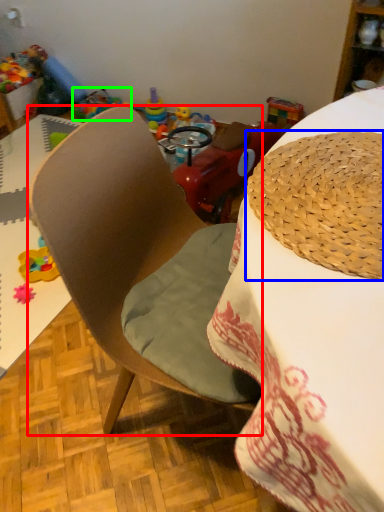
Question: Which object is positioned farthest from chair (highlighted by a red box)? Select from hat (highlighted by a blue box) and toy (highlighted by a green box).

Choices:
 (A) hat
 (B) toy

Answer: (B)